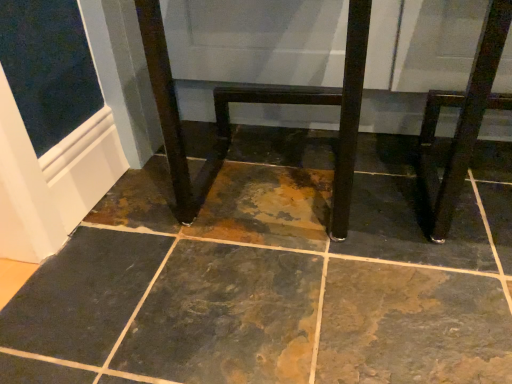
Question: Is shiny dark wood stool at right bigger or smaller than matte black table at center?

Choices:
 (A) small
 (B) big

Answer: (A)

Question: In terms of width, does shiny dark wood stool at right look wider or thinner when compared to matte black table at center?

Choices:
 (A) wide
 (B) thin

Answer: (B)

Question: Is point (489, 89) positioned closer to the camera than point (480, 66)?

Choices:
 (A) closer
 (B) farther

Answer: (B)

Question: From their relative heights in the image, would you say matte black table at center is taller or shorter than shiny dark wood stool at right?

Choices:
 (A) short
 (B) tall

Answer: (B)

Question: Is matte black table at center bigger or smaller than shiny dark wood stool at right?

Choices:
 (A) small
 (B) big

Answer: (B)

Question: In terms of width, does matte black table at center look wider or thinner when compared to shiny dark wood stool at right?

Choices:
 (A) thin
 (B) wide

Answer: (B)

Question: Which is correct: matte black table at center is inside shiny dark wood stool at right, or outside of it?

Choices:
 (A) outside
 (B) inside

Answer: (A)